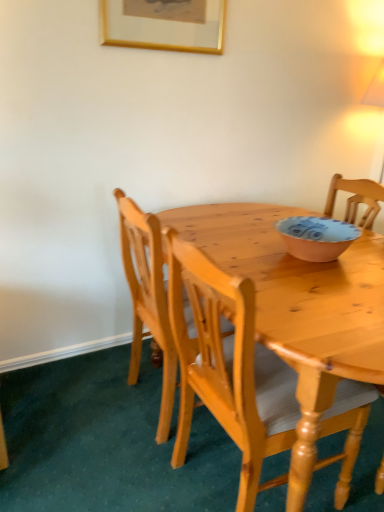
You are a GUI agent. You are given a task and a screenshot of the screen. Output one action in this format:
    pyautogui.click(x=<x>, y=<y>)
    Task: Click on the light brown wooden chair at center, the first chair positioned from the front
    
    Given the screenshot: What is the action you would take?
    pyautogui.click(x=230, y=369)

This screenshot has height=512, width=384. Describe the element at coordinates (230, 369) in the screenshot. I see `light brown wooden chair at center, the first chair positioned from the front` at that location.

Measure the distance between matte pink bowl at center and camera.

4.51 feet.

Identify the location of light brown wooden chair at center, acting as the 2th chair starting from the back. (230, 369).

Does point (312, 243) appear closer or farther from the camera than point (243, 296)?

Point (312, 243) is positioned farther from the camera compared to point (243, 296).

From a real-world perspective, is matte pink bowl at center physically located above or below light brown wooden chair at center, the first chair positioned from the front?

Clearly, from a real-world perspective, matte pink bowl at center is above light brown wooden chair at center, the first chair positioned from the front.

Is matte pink bowl at center turned away from light brown wooden chair at center, the first chair positioned from the front?

matte pink bowl at center does not have its back to light brown wooden chair at center, the first chair positioned from the front.

Visually, is matte pink bowl at center positioned to the left or to the right of light brown wooden chair at center, the first chair positioned from the front?

matte pink bowl at center is positioned on light brown wooden chair at center, the first chair positioned from the front,'s right side.

From a real-world perspective, is light brown wooden chair at center, the second chair when ordered from front to back, on matte pink bowl at center?

No.

Does light brown wooden chair at center, acting as the 1th chair starting from the back, have a smaller size compared to matte pink bowl at center?

No, light brown wooden chair at center, acting as the 1th chair starting from the back, is not smaller than matte pink bowl at center.

Which is more to the left, light brown wooden chair at center, the second chair when ordered from front to back, or matte pink bowl at center?

Positioned to the left is light brown wooden chair at center, the second chair when ordered from front to back.

Measure the distance from light brown wooden chair at center, the second chair when ordered from front to back, to matte pink bowl at center.

The distance of light brown wooden chair at center, the second chair when ordered from front to back, from matte pink bowl at center is 55.61 centimeters.

Does gold-framed picture at upper center have a greater height compared to light brown wooden chair at center, acting as the 1th chair starting from the back?

Incorrect, the height of gold-framed picture at upper center is not larger of that of light brown wooden chair at center, acting as the 1th chair starting from the back.

Based on the photo, does gold-framed picture at upper center have a smaller size compared to light brown wooden chair at center, acting as the 1th chair starting from the back?

Yes.

Which object is positioned more to the right, gold-framed picture at upper center or light brown wooden chair at center, the second chair when ordered from front to back?

Positioned to the right is light brown wooden chair at center, the second chair when ordered from front to back.

From a real-world perspective, is light brown wooden chair at center, acting as the 2th chair starting from the back, beneath gold-framed picture at upper center?

Yes.

From the image's perspective, which object appears higher, light brown wooden chair at center, the first chair positioned from the front, or gold-framed picture at upper center?

gold-framed picture at upper center, from the image's perspective.

Based on the photo, which object is thinner, light brown wooden chair at center, acting as the 2th chair starting from the back, or gold-framed picture at upper center?

With smaller width is gold-framed picture at upper center.

Where is `the 2nd chair to the right when counting from the gold-framed picture at upper center`? The image size is (384, 512). the 2nd chair to the right when counting from the gold-framed picture at upper center is located at coordinates (230, 369).

Consider the image. Can you confirm if light brown wooden chair at center, acting as the 1th chair starting from the back, is positioned to the left of light brown wooden chair at center, the first chair positioned from the front?

Indeed, light brown wooden chair at center, acting as the 1th chair starting from the back, is positioned on the left side of light brown wooden chair at center, the first chair positioned from the front.

This screenshot has width=384, height=512. I want to click on chair that appears above the light brown wooden chair at center, acting as the 2th chair starting from the back (from the image's perspective), so click(147, 298).

Looking at this image, is light brown wooden chair at center, the second chair when ordered from front to back, not within light brown wooden chair at center, acting as the 2th chair starting from the back?

That's correct, light brown wooden chair at center, the second chair when ordered from front to back, is outside of light brown wooden chair at center, acting as the 2th chair starting from the back.

Does light brown wooden chair at center, the second chair when ordered from front to back, lie behind light brown wooden chair at center, acting as the 2th chair starting from the back?

Yes, the depth of light brown wooden chair at center, the second chair when ordered from front to back, is greater than that of light brown wooden chair at center, acting as the 2th chair starting from the back.

From a real-world perspective, is light brown wooden chair at center, the second chair when ordered from front to back, below gold-framed picture at upper center?

Yes, from a real-world perspective, light brown wooden chair at center, the second chair when ordered from front to back, is beneath gold-framed picture at upper center.

Starting from the gold-framed picture at upper center, which chair is the 1st one in front? Please provide its 2D coordinates.

[(147, 298)]

How different are the orientations of light brown wooden chair at center, the second chair when ordered from front to back, and gold-framed picture at upper center in degrees?

The angular difference between light brown wooden chair at center, the second chair when ordered from front to back, and gold-framed picture at upper center is 92.1 degrees.

In terms of size, does gold-framed picture at upper center appear bigger or smaller than matte pink bowl at center?

Considering their sizes, gold-framed picture at upper center takes up less space than matte pink bowl at center.

Consider the image. How different are the orientations of gold-framed picture at upper center and matte pink bowl at center in degrees?

The angular difference between gold-framed picture at upper center and matte pink bowl at center is 0.279 degrees.

From the image's perspective, is gold-framed picture at upper center located above or below matte pink bowl at center?

From the image's perspective, gold-framed picture at upper center appears above matte pink bowl at center.

From a real-world perspective, which is physically above, gold-framed picture at upper center or matte pink bowl at center?

gold-framed picture at upper center, from a real-world perspective.

From a real-world perspective, starting from the matte pink bowl at center, which chair is the 2nd one below it? Please provide its 2D coordinates.

[(230, 369)]

Find the location of a particular element. The image size is (384, 512). chair that is the 1st one when counting downward from the matte pink bowl at center (from the image's perspective) is located at coordinates 147,298.

When comparing their distances from gold-framed picture at upper center, does light brown wooden chair at center, acting as the 1th chair starting from the back, or matte pink bowl at center seem closer?

Among the two, light brown wooden chair at center, acting as the 1th chair starting from the back, is located nearer to gold-framed picture at upper center.

Considering their positions, is matte pink bowl at center positioned closer to light brown wooden chair at center, the second chair when ordered from front to back, than gold-framed picture at upper center?

matte pink bowl at center is positioned closer to the anchor light brown wooden chair at center, the second chair when ordered from front to back.

Estimate the real-world distances between objects in this image. Which object is further from light brown wooden chair at center, the second chair when ordered from front to back, light brown wooden chair at center, the first chair positioned from the front, or gold-framed picture at upper center?

gold-framed picture at upper center lies further to light brown wooden chair at center, the second chair when ordered from front to back, than the other object.

Estimate the real-world distances between objects in this image. Which object is further from gold-framed picture at upper center, light brown wooden chair at center, acting as the 1th chair starting from the back, or light brown wooden chair at center, the first chair positioned from the front?

light brown wooden chair at center, the first chair positioned from the front.

Looking at the image, which one is located further to gold-framed picture at upper center, matte pink bowl at center or light brown wooden chair at center, the first chair positioned from the front?

Based on the image, light brown wooden chair at center, the first chair positioned from the front, appears to be further to gold-framed picture at upper center.

Looking at the image, which one is located further to matte pink bowl at center, light brown wooden chair at center, acting as the 2th chair starting from the back, or light brown wooden chair at center, acting as the 1th chair starting from the back?

The object further to matte pink bowl at center is light brown wooden chair at center, acting as the 1th chair starting from the back.

Based on their spatial positions, is gold-framed picture at upper center or matte pink bowl at center closer to light brown wooden chair at center, acting as the 2th chair starting from the back?

matte pink bowl at center lies closer to light brown wooden chair at center, acting as the 2th chair starting from the back, than the other object.

Consider the image. From the image, which object appears to be farther from gold-framed picture at upper center, light brown wooden chair at center, acting as the 2th chair starting from the back, or light brown wooden chair at center, acting as the 1th chair starting from the back?

light brown wooden chair at center, acting as the 2th chair starting from the back, is positioned further to the anchor gold-framed picture at upper center.

Find the location of a particular element. bowl between gold-framed picture at upper center and light brown wooden chair at center, acting as the 1th chair starting from the back, from top to bottom is located at coordinates (316, 237).

This screenshot has height=512, width=384. What are the coordinates of `chair between light brown wooden chair at center, acting as the 2th chair starting from the back, and matte pink bowl at center from front to back` in the screenshot? It's located at (147, 298).

Find the location of `bowl between gold-framed picture at upper center and light brown wooden chair at center, the first chair positioned from the front, vertically`. bowl between gold-framed picture at upper center and light brown wooden chair at center, the first chair positioned from the front, vertically is located at coordinates (316, 237).

Find the location of a particular element. Image resolution: width=384 pixels, height=512 pixels. chair between gold-framed picture at upper center and light brown wooden chair at center, acting as the 2th chair starting from the back, in the vertical direction is located at coordinates (147, 298).